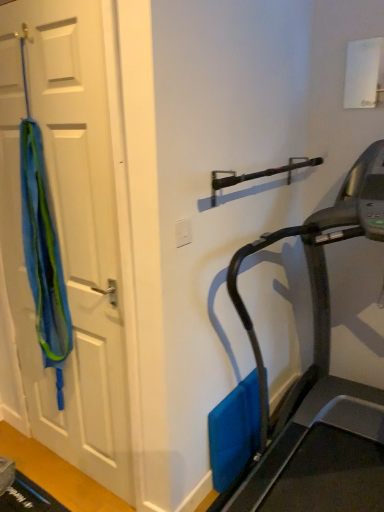
The height and width of the screenshot is (512, 384). Describe the element at coordinates (69, 231) in the screenshot. I see `blue fabric at left` at that location.

What is the approximate width of blue fabric at left?

The width of blue fabric at left is 3.21 inches.

At what (x,y) coordinates should I click in order to perform the action: click on black metallic door handle at upper center. Please return your answer as a coordinate pair (x, y). Looking at the image, I should click on (258, 174).

Between black metallic door handle at upper center and white plastic electric outlet at center, which one appears on the left side from the viewer's perspective?

white plastic electric outlet at center.

From the image's perspective, does black metallic door handle at upper center appear higher than white plastic electric outlet at center?

Indeed, from the image's perspective, black metallic door handle at upper center is shown above white plastic electric outlet at center.

From a real-world perspective, is black metallic door handle at upper center under white plastic electric outlet at center?

No, from a real-world perspective, black metallic door handle at upper center is not below white plastic electric outlet at center.

Does point (222, 188) lie in front of point (180, 244)?

No.

In the scene shown: Who is bigger, white plastic electric outlet at center or blue fabric at left?

blue fabric at left is bigger.

Does white plastic electric outlet at center appear on the left side of blue fabric at left?

No, white plastic electric outlet at center is not to the left of blue fabric at left.

Which is in front, white plastic electric outlet at center or blue fabric at left?

Positioned in front is blue fabric at left.

Looking at this image, considering the sizes of objects white plastic electric outlet at center and blue fabric at left in the image provided, who is wider, white plastic electric outlet at center or blue fabric at left?

With larger width is blue fabric at left.

Between point (37, 170) and point (179, 242), which one is positioned behind?

The point (37, 170) is farther.

Identify the location of electric outlet on the right side of blue fabric at left. (183, 232).

Considering the relative sizes of blue fabric at left and white plastic electric outlet at center in the image provided, is blue fabric at left shorter than white plastic electric outlet at center?

In fact, blue fabric at left may be taller than white plastic electric outlet at center.

From the image's perspective, is black metallic door handle at upper center located above or below blue fabric at left?

black metallic door handle at upper center is above blue fabric at left.

Is black metallic door handle at upper center wider or thinner than blue fabric at left?

Clearly, black metallic door handle at upper center has more width compared to blue fabric at left.

How distant is black metallic door handle at upper center from blue fabric at left?

black metallic door handle at upper center is 30.80 inches away from blue fabric at left.

Is black metallic door handle at upper center situated inside blue fabric at left or outside?

black metallic door handle at upper center cannot be found inside blue fabric at left.

From a real-world perspective, who is located higher, black metallic door handle at upper center or blue fabric at left?

In real-world perspective, black metallic door handle at upper center is above.

Does black metallic door handle at upper center have a larger size compared to blue fabric at left?

Actually, black metallic door handle at upper center might be smaller than blue fabric at left.

Are black metallic door handle at upper center and blue fabric at left making contact?

There is a gap between black metallic door handle at upper center and blue fabric at left.

Which of these two, black metallic door handle at upper center or blue fabric at left, is wider?

black metallic door handle at upper center.

How much distance is there between white plastic electric outlet at center and blue fabric at left?

white plastic electric outlet at center and blue fabric at left are 66.76 centimeters apart from each other.

Is white plastic electric outlet at center bigger or smaller than blue fabric at left?

Clearly, white plastic electric outlet at center is smaller in size than blue fabric at left.

Is point (177, 242) closer or farther from the camera than point (25, 189)?

Point (177, 242) appears to be closer to the viewer than point (25, 189).

From the picture: Does white plastic electric outlet at center contain blue fabric at left?

No, blue fabric at left is located outside of white plastic electric outlet at center.

Considering their positions, is blue fabric at left located in front of or behind white plastic electric outlet at center?

blue fabric at left is positioned closer to the viewer than white plastic electric outlet at center.

From a real-world perspective, is blue fabric at left positioned under white plastic electric outlet at center based on gravity?

Correct, in the physical world, blue fabric at left is lower than white plastic electric outlet at center.

Which of these two, blue fabric at left or white plastic electric outlet at center, is thinner?

white plastic electric outlet at center.

Considering the points (18, 144) and (178, 238), which point is behind, point (18, 144) or point (178, 238)?

The point (18, 144) is behind.

This screenshot has height=512, width=384. Identify the location of electric outlet below the black metallic door handle at upper center (from the image's perspective). (183, 232).

Locate an element on the screen. This screenshot has height=512, width=384. door in front of the white plastic electric outlet at center is located at coordinates (69, 231).

When comparing their distances from blue fabric at left, does blue fabric at left or black metallic door handle at upper center seem further?

black metallic door handle at upper center lies further to blue fabric at left than the other object.

Based on their spatial positions, is white plastic electric outlet at center or blue fabric at left closer to blue fabric at left?

The object closer to blue fabric at left is blue fabric at left.

When comparing their distances from blue fabric at left, does black metallic door handle at upper center or blue fabric at left seem closer?

Among the two, blue fabric at left is located nearer to blue fabric at left.

Based on their spatial positions, is white plastic electric outlet at center or blue fabric at left further from black metallic door handle at upper center?

blue fabric at left.

Looking at the image, which one is located further to black metallic door handle at upper center, blue fabric at left or blue fabric at left?

Among the two, blue fabric at left is located further to black metallic door handle at upper center.

Which object lies further to the anchor point blue fabric at left, white plastic electric outlet at center or black metallic door handle at upper center?

black metallic door handle at upper center is further to blue fabric at left.

Considering their positions, is blue fabric at left positioned closer to black metallic door handle at upper center than white plastic electric outlet at center?

white plastic electric outlet at center is positioned closer to the anchor black metallic door handle at upper center.

When comparing their distances from white plastic electric outlet at center, does black metallic door handle at upper center or blue fabric at left seem further?

The object further to white plastic electric outlet at center is blue fabric at left.

You are a GUI agent. You are given a task and a screenshot of the screen. Output one action in this format:
    pyautogui.click(x=<x>, y=<y>)
    Task: Click on the door located between blue fabric at left and black metallic door handle at upper center in the left-right direction
    
    Given the screenshot: What is the action you would take?
    pyautogui.click(x=69, y=231)

At what (x,y) coordinates should I click in order to perform the action: click on electric outlet between blue fabric at left and black metallic door handle at upper center in the horizontal direction. Please return your answer as a coordinate pair (x, y). The height and width of the screenshot is (512, 384). Looking at the image, I should click on (183, 232).

Locate an element on the screen. Image resolution: width=384 pixels, height=512 pixels. electric outlet between blue fabric at left and black metallic door handle at upper center from left to right is located at coordinates (183, 232).

The height and width of the screenshot is (512, 384). I want to click on door between blue fabric at left and white plastic electric outlet at center from left to right, so click(x=69, y=231).